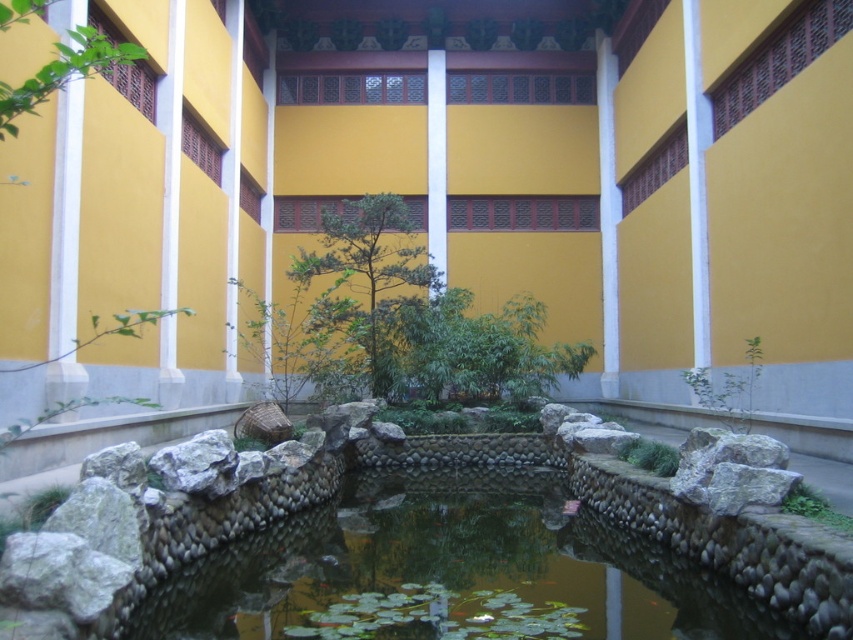
Question: Which object is positioned closest to the green matte tree at center?

Choices:
 (A) clear stone water at center
 (B) green leafy tree at upper left

Answer: (A)

Question: Does green matte tree at center have a greater width compared to green leafy tree at upper left?

Choices:
 (A) yes
 (B) no

Answer: (A)

Question: Can you confirm if green matte tree at center is smaller than green leafy tree at upper left?

Choices:
 (A) yes
 (B) no

Answer: (B)

Question: Which object appears farthest from the camera in this image?

Choices:
 (A) clear stone water at center
 (B) green matte tree at center

Answer: (B)

Question: Can you confirm if green matte tree at center is positioned to the right of green leafy tree at upper left?

Choices:
 (A) yes
 (B) no

Answer: (B)

Question: Estimate the real-world distances between objects in this image. Which object is closer to the green leafy tree at upper left?

Choices:
 (A) clear stone water at center
 (B) green matte tree at center

Answer: (A)